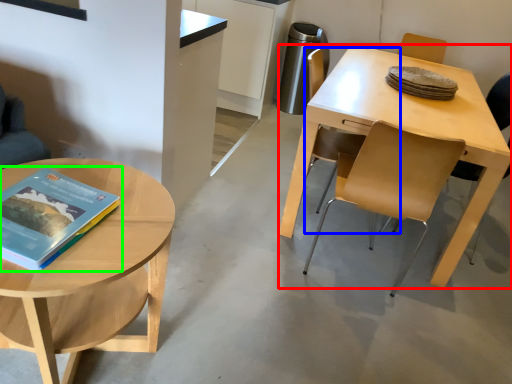
Question: Based on their relative distances, which object is nearer to desk (highlighted by a red box)? Choose from chair (highlighted by a blue box) and book (highlighted by a green box).

Choices:
 (A) chair
 (B) book

Answer: (A)